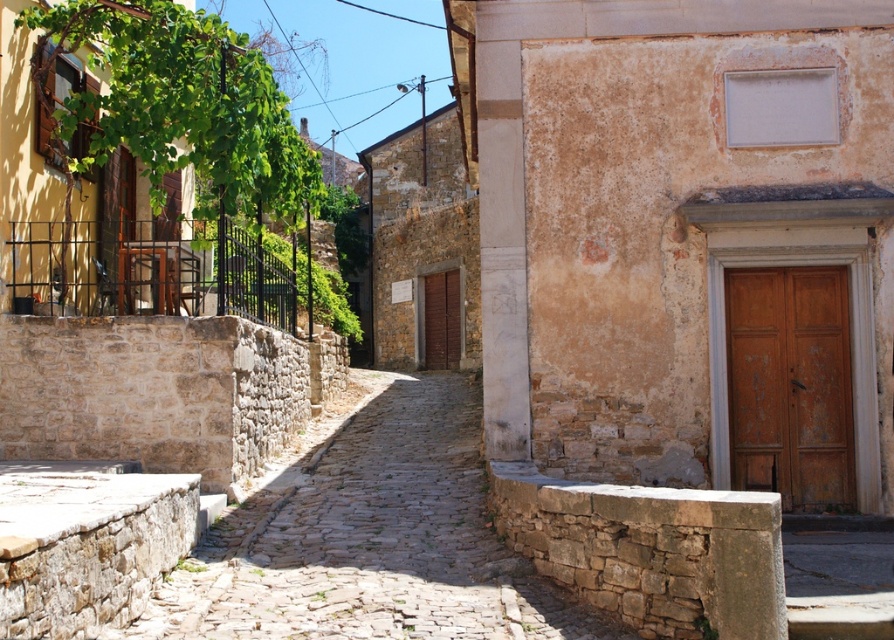
You are a tourist standing on the cobblestone path in the historic village. You want to enter the building with the light yellow facade. Which door should you approach first, the wooden door at right or the brown wooden door at center?

You should approach the wooden door at right first because it is positioned under the brown wooden door at center, meaning it is closer to the ground level and accessible from the cobblestone path.

You are standing at the entrance of the building with a light yellow facade on the left side of the image. You want to walk straight ahead along the cobblestone path. Will the wooden door at right block your path?

The wooden door at right is located at coordinates point [790,385], which is not directly in front of you along the cobblestone path. Therefore, it will not block your path.